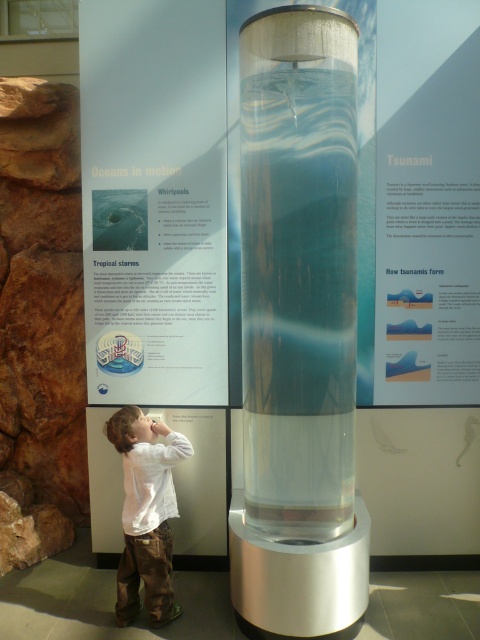
You are a visitor at the exhibit and want to take a photo of the white paper at upper right and white cotton shirt at lower left. Which object should you zoom in on to ensure both are in the frame?

The white paper at upper right might be wider than white cotton shirt at lower left, so you should zoom in on the white cotton shirt at lower left to ensure both are in the frame.

You are a visitor at the exhibit and want to read the white paper at upper right. Where should you look to find it?

The white paper at upper right is located at the coordinates point (x=427, y=204) in the image.